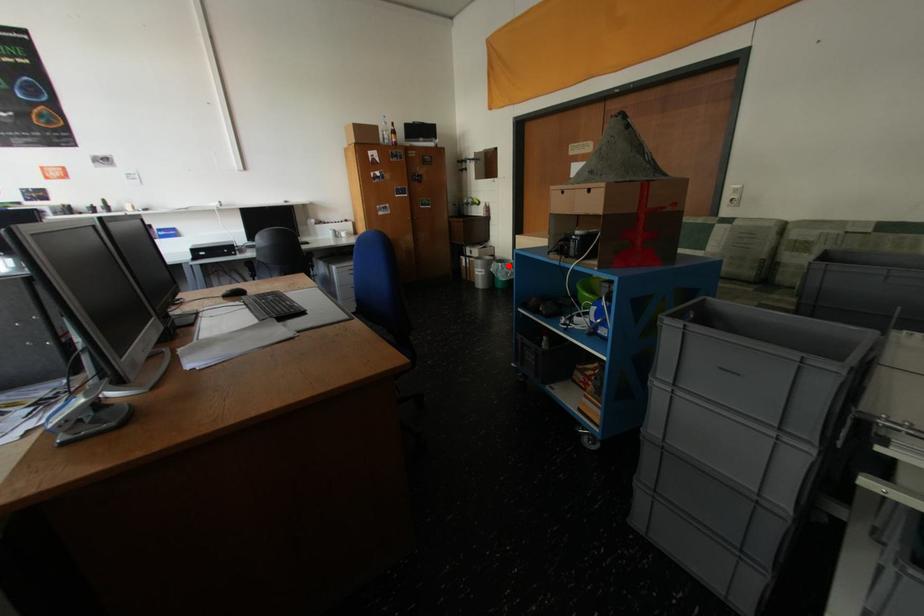
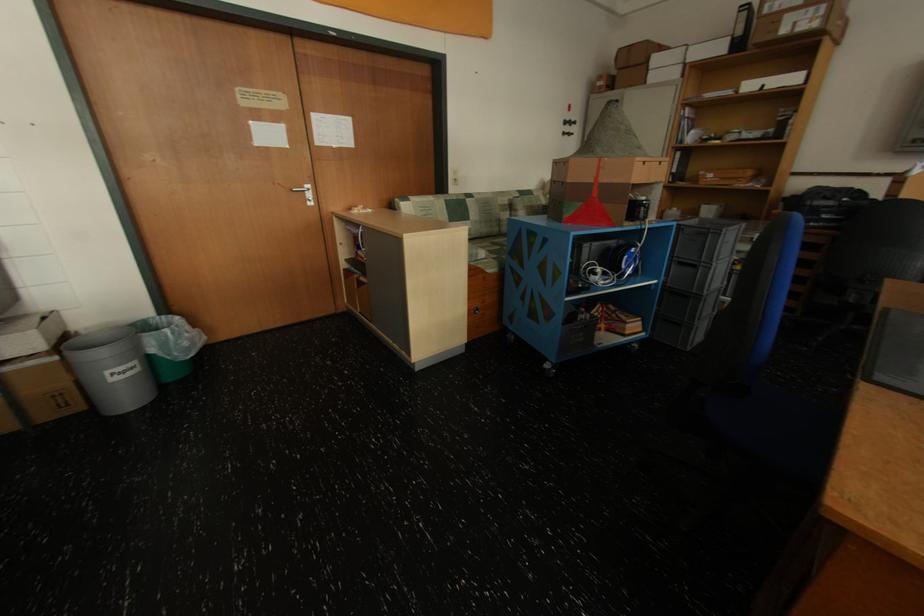
The point at the highlighted location is marked in the first image. Where is the corresponding point in the second image?

(176, 331)